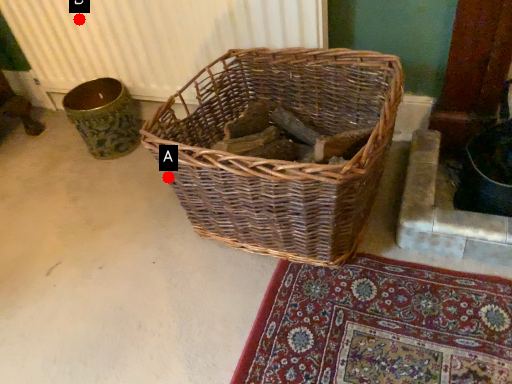
Question: Two points are circled on the image, labeled by A and B beside each circle. Among these points, which one is nearest to the camera?

Choices:
 (A) A is closer
 (B) B is closer

Answer: (A)